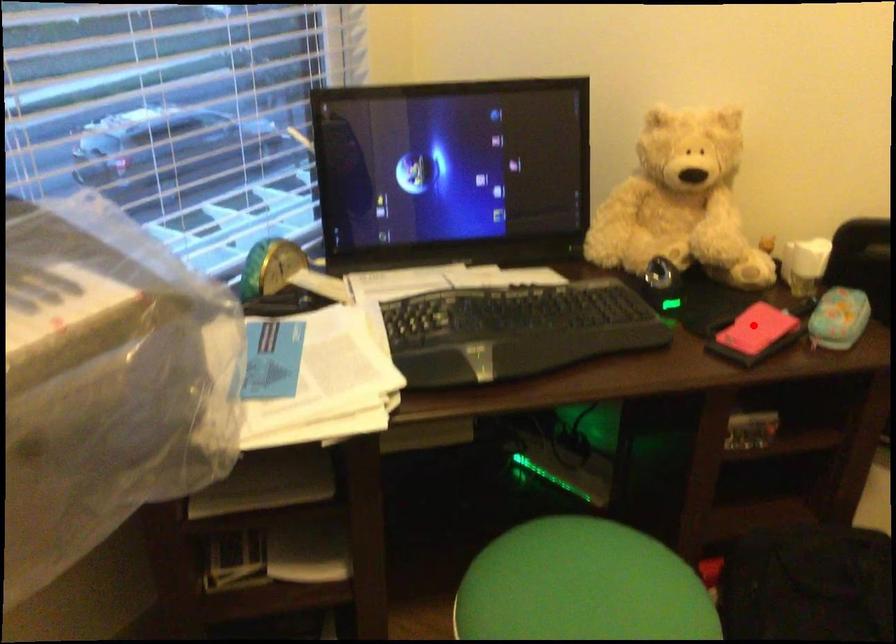
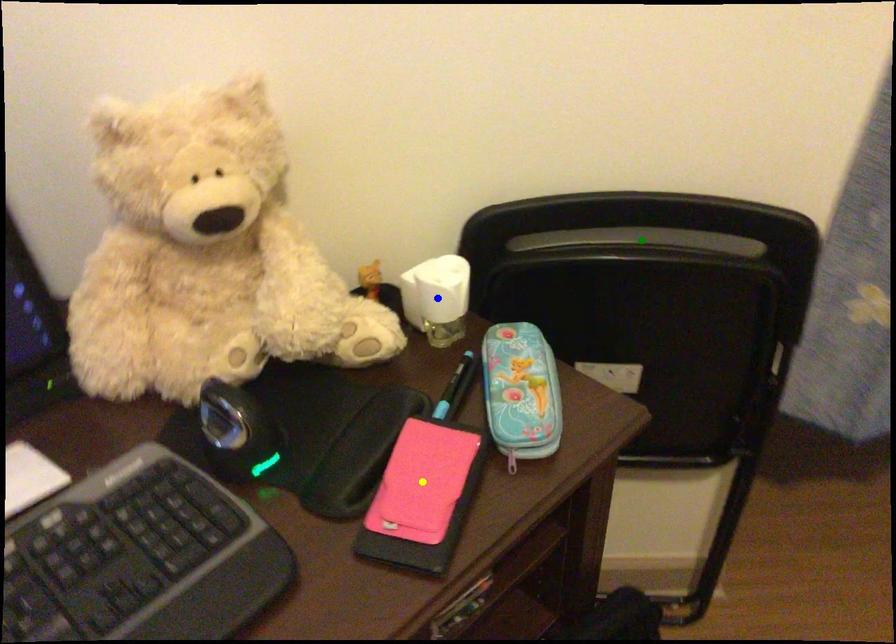
Question: I am providing you with two images of the same scene from different viewpoints. A red point is marked on the first image. You are given multiple points on the second image. In image 2, which mark is for the same physical point as the one in image 1?

Choices:
 (A) yellow point
 (B) green point
 (C) blue point

Answer: (A)